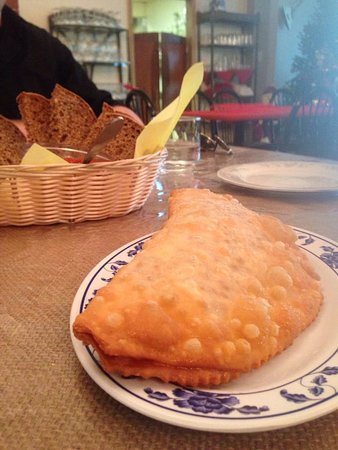
This screenshot has height=450, width=338. I want to click on rack, so click(83, 25), click(208, 47).